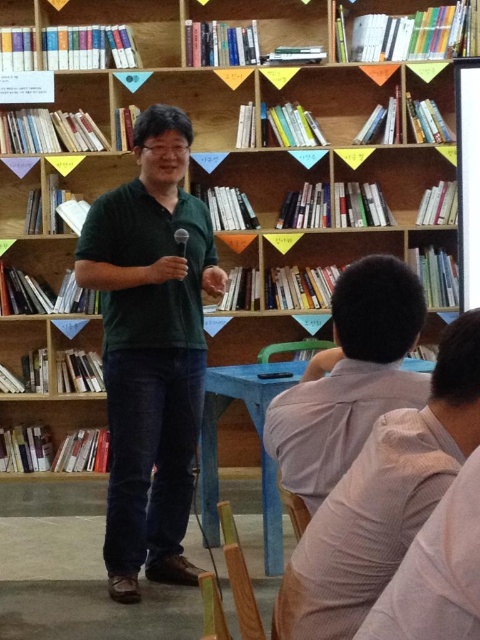
You are standing in the library and want to point to the exact location of point (151, 349). Which object does this point lie on?

The point (151, 349) lies on the green matte shirt at center.

Based on the photo, you are an attendee at the event and want to take a photo of the speaker. The speaker is wearing a green matte shirt at center. Where should you position yourself to capture the speaker in the center of your photo?

You should position yourself directly in front of the green matte shirt at center, which is located at point 0.547 on the horizontal axis and 0.315 on the vertical axis, to ensure the speaker is centered in your photo.

You are standing at point A, which is at the bottom left corner of the image. You want to walk to the gray cotton shirt at lower right located at point B, which is at point (383, 499). The path between you and the gray cotton shirt at lower right is blocked by a bookshelf. What direction should you move first to avoid the obstacle?

You should move to the right first to avoid the bookshelf blocking the path to the gray cotton shirt at lower right located at point (383, 499).